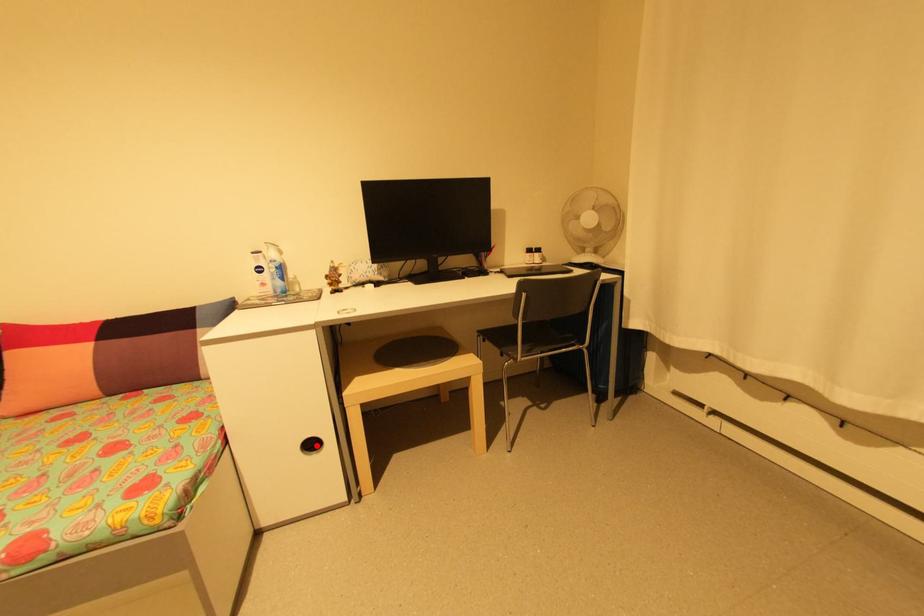
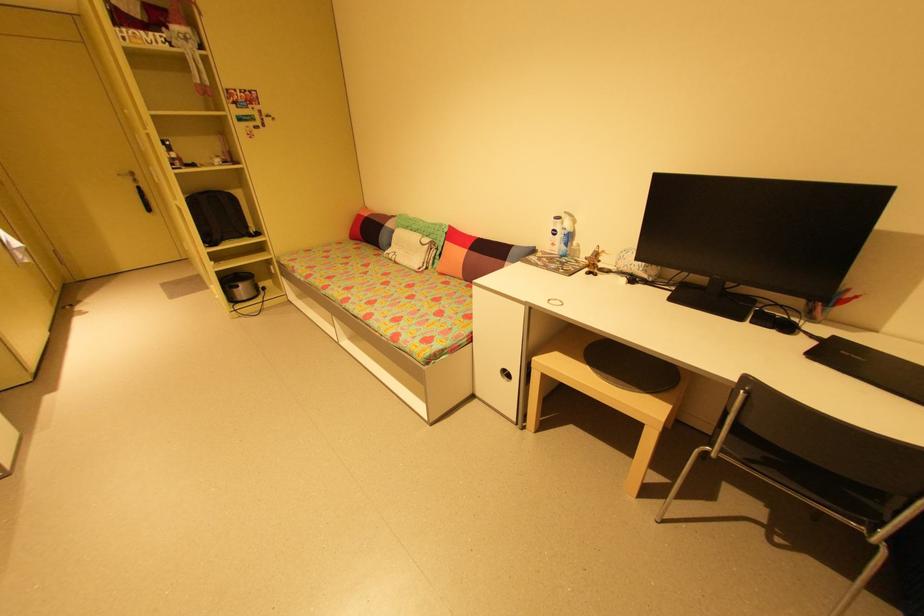
Question: I am providing you with two images of the same scene from different viewpoints. A red point is shown in image1. For the corresponding object point in image2, is it positioned nearer or farther from the camera?

Choices:
 (A) Nearer
 (B) Farther

Answer: (A)